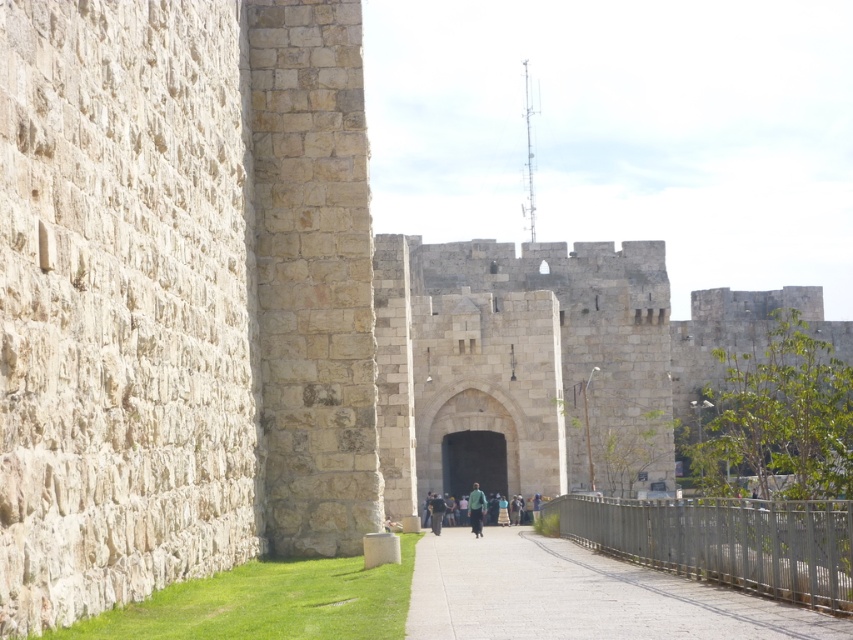
You are standing on the pathway leading to the gateway and want to take a photo of the historic stone wall. You notice two specific points marked as point 1 and point 2 on the wall. Point 1 is at coordinate (476, 452) and point 2 is at (471, 516). Which point should you focus on to ensure it appears closer in your photo?

Point 1 at coordinate (476, 452) should be focused on because it is closer to the viewer than point 2 at (471, 516), making it appear nearer in the photo.

You are a tour guide leading a group through the historic site. You want to ensure that the green fabric person at center can pass through the black stone archway at center. Based on the scene, can they fit through the archway?

The black stone archway at center has a lesser width compared to green fabric person at center, so the green fabric person at center may not fit through the archway.

You are standing at the entrance of the historic site and want to reach the arched gateway visible in the distance. The smooth concrete path at center is your only route. Given that the path is 79.81 feet away from you, can you estimate how long it would take to walk to the gateway if your average walking speed is 3 feet per second?

The smooth concrete path at center is 79.81 feet away. At a walking speed of 3 feet per second, it would take approximately 26.6 seconds to reach the gateway.